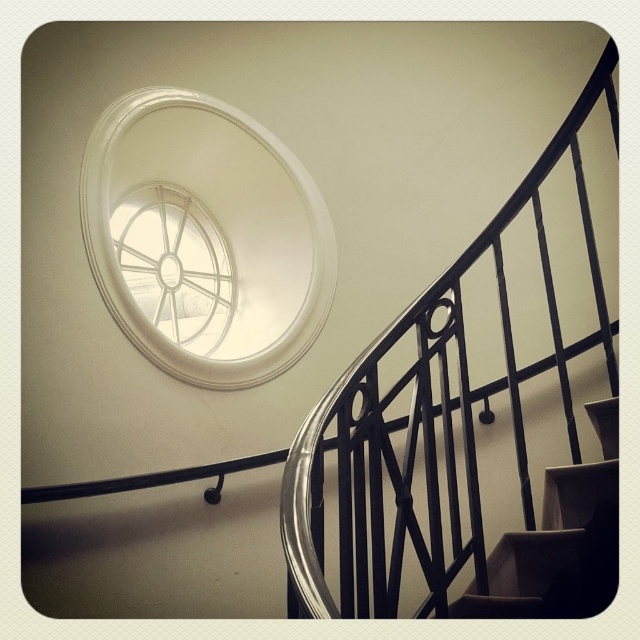
Question: Is black metal railing at upper right to the left of white glass spiral at upper center from the viewer's perspective?

Choices:
 (A) no
 (B) yes

Answer: (A)

Question: Which point is closer to the camera taking this photo?

Choices:
 (A) (323, 282)
 (B) (483, 600)
 (C) (308, 589)
 (D) (170, 301)

Answer: (C)

Question: Among these points, which one is nearest to the camera?

Choices:
 (A) (160, 246)
 (B) (512, 566)
 (C) (211, 164)

Answer: (B)

Question: Can you confirm if white glass window at upper center is bigger than black metal railing at upper right?

Choices:
 (A) no
 (B) yes

Answer: (B)

Question: Is smooth beige stairs at lower right bigger than white glass spiral at upper center?

Choices:
 (A) yes
 (B) no

Answer: (B)

Question: Among these points, which one is farthest from the camera?

Choices:
 (A) (611, 477)
 (B) (204, 368)
 (C) (292, 611)
 (D) (173, 204)

Answer: (D)